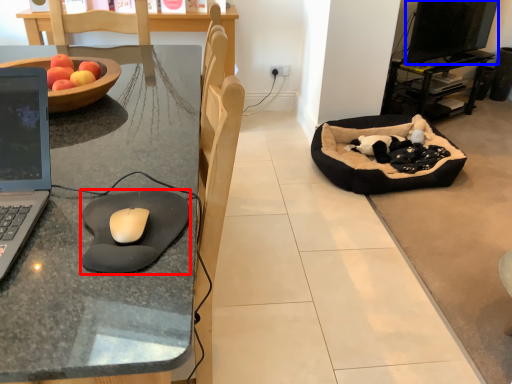
Question: Which object appears closest to the camera in this image, mousepad (highlighted by a red box) or computer monitor (highlighted by a blue box)?

Choices:
 (A) mousepad
 (B) computer monitor

Answer: (A)